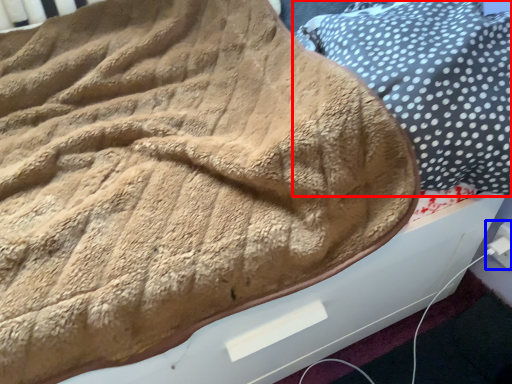
Question: Among these objects, which one is farthest to the camera, pillow (highlighted by a red box) or electric outlet (highlighted by a blue box)?

Choices:
 (A) pillow
 (B) electric outlet

Answer: (B)